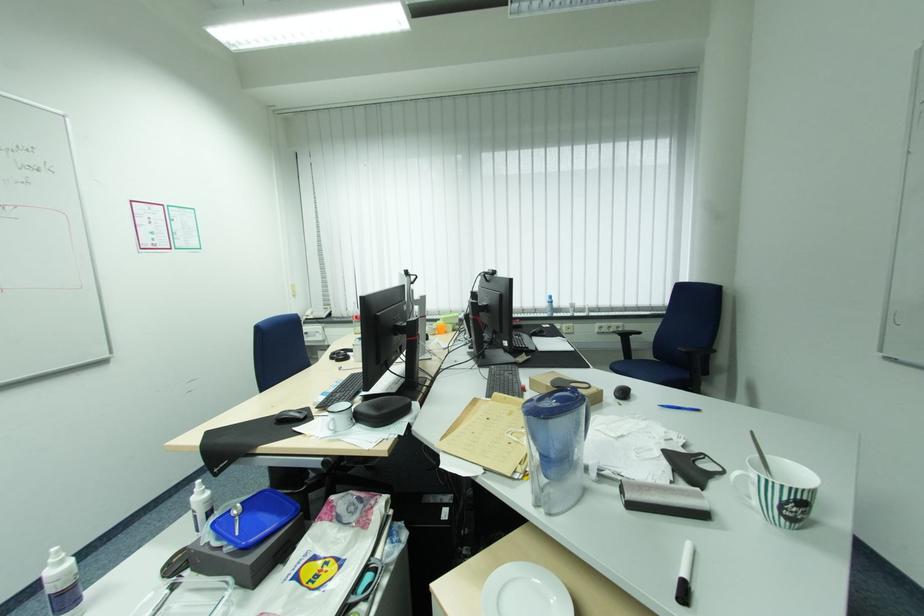
The width and height of the screenshot is (924, 616). What are the coordinates of `blue chair sitting surface` in the screenshot? It's located at (648, 368).